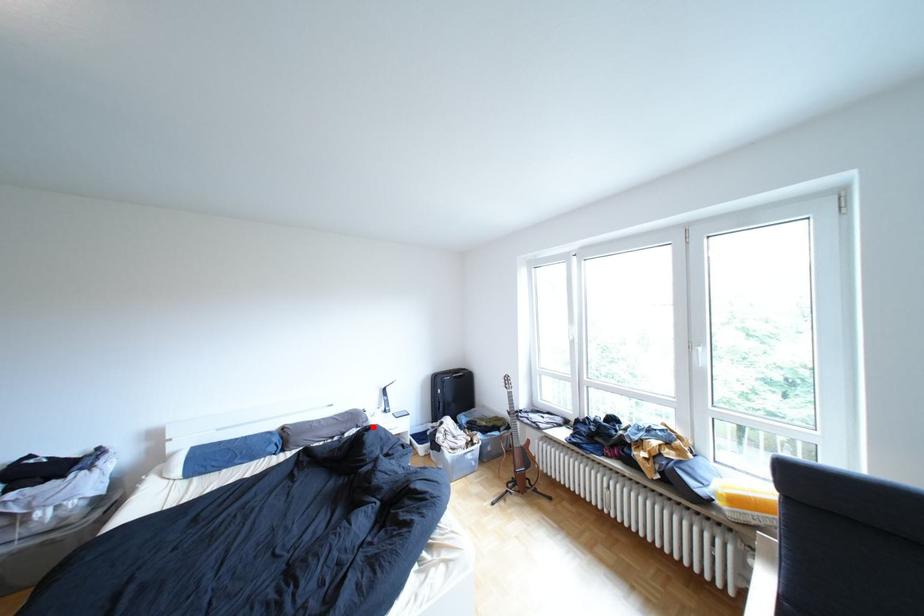
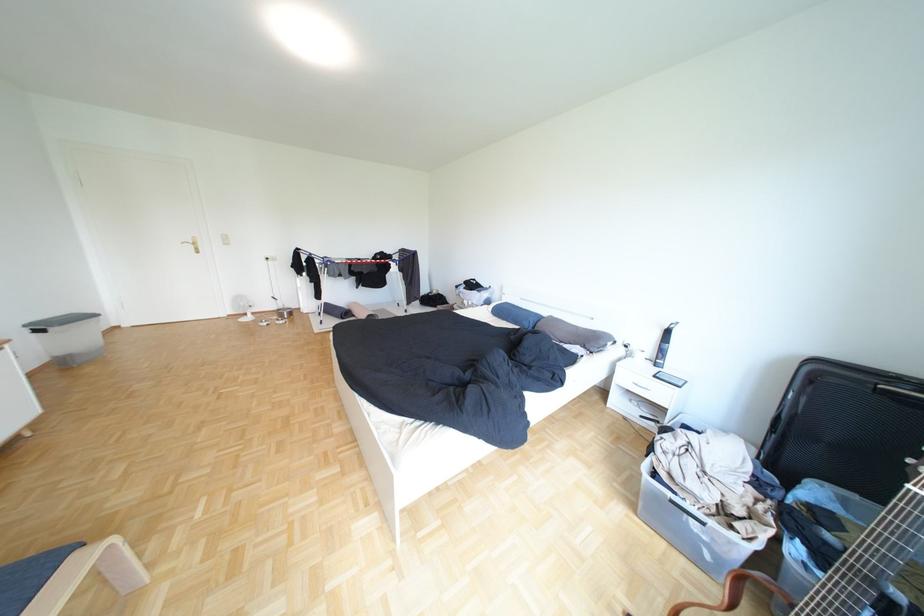
The point at the highlighted location is marked in the first image. Where is the corresponding point in the second image?

(600, 347)